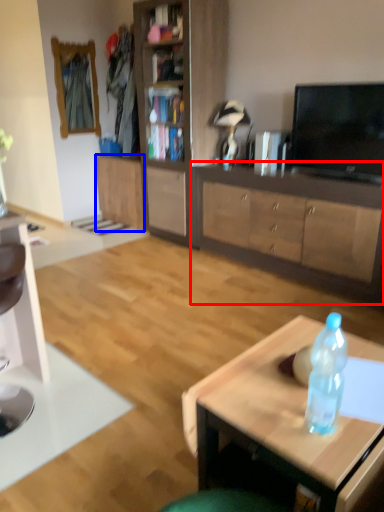
Question: Which of the following is the closest to the observer, cabinetry (highlighted by a red box) or cabinetry (highlighted by a blue box)?

Choices:
 (A) cabinetry
 (B) cabinetry

Answer: (A)